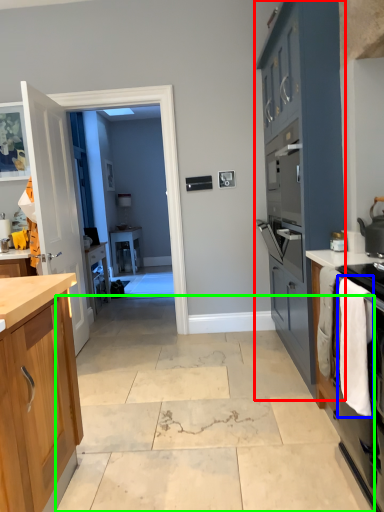
Question: Considering the real-world distances, which object is closest to cabinetry (highlighted by a red box)? laundry (highlighted by a blue box) or concrete (highlighted by a green box).

Choices:
 (A) laundry
 (B) concrete

Answer: (A)